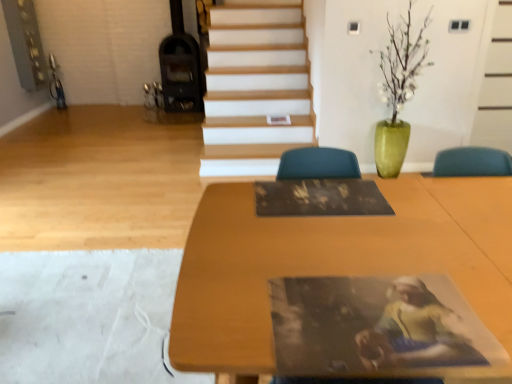
In order to click on dark brown wood fireplace at upper left in this screenshot , I will do `click(177, 77)`.

The image size is (512, 384). What do you see at coordinates (177, 77) in the screenshot?
I see `dark brown wood fireplace at upper left` at bounding box center [177, 77].

The image size is (512, 384). Describe the element at coordinates (334, 261) in the screenshot. I see `wooden table at center` at that location.

Find the location of a particular element. wooden table at center is located at coordinates (334, 261).

Based on the photo, what is the approximate width of wooden table at center?

The width of wooden table at center is 91.48 centimeters.

Looking at this image, what is the approximate height of wooden table at center?

78.17 centimeters.

Identify the location of dark brown wood fireplace at upper left. The image size is (512, 384). 177,77.

Which object is positioned more to the left, dark brown wood fireplace at upper left or wooden table at center?

Positioned to the left is dark brown wood fireplace at upper left.

In the image, is dark brown wood fireplace at upper left positioned in front of or behind wooden table at center?

Visually, dark brown wood fireplace at upper left is located behind wooden table at center.

Which is in front, point (163, 108) or point (485, 368)?

Point (485, 368)

From the image's perspective, does dark brown wood fireplace at upper left appear higher than wooden table at center?

Correct, dark brown wood fireplace at upper left appears higher than wooden table at center in the image.

From a real-world perspective, is dark brown wood fireplace at upper left beneath wooden table at center?

No, from a real-world perspective, dark brown wood fireplace at upper left is not under wooden table at center.

Between dark brown wood fireplace at upper left and wooden table at center, which one has larger width?

Wider between the two is wooden table at center.

Is dark brown wood fireplace at upper left taller than wooden table at center?

Yes.

Considering the relative sizes of dark brown wood fireplace at upper left and wooden table at center in the image provided, is dark brown wood fireplace at upper left smaller than wooden table at center?

Yes.

Is dark brown wood fireplace at upper left situated inside wooden table at center or outside?

dark brown wood fireplace at upper left lies outside wooden table at center.

Based on the photo, is the surface of dark brown wood fireplace at upper left in direct contact with wooden table at center?

No, dark brown wood fireplace at upper left is not beside wooden table at center.

Could you tell me if dark brown wood fireplace at upper left is turned towards wooden table at center?

No, dark brown wood fireplace at upper left is not turned towards wooden table at center.

At what (x,y) coordinates should I click in order to perform the action: click on fireplace lying above the wooden table at center (from the image's perspective). Please return your answer as a coordinate pair (x, y). This screenshot has height=384, width=512. Looking at the image, I should click on (177, 77).

Can you confirm if wooden table at center is positioned to the left of dark brown wood fireplace at upper left?

Incorrect, wooden table at center is not on the left side of dark brown wood fireplace at upper left.

In the scene shown: Is wooden table at center in front of or behind dark brown wood fireplace at upper left in the image?

Clearly, wooden table at center is in front of dark brown wood fireplace at upper left.

Does point (507, 177) come behind point (176, 71)?

No, (507, 177) is closer to viewer.

From the image's perspective, is wooden table at center above or below dark brown wood fireplace at upper left?

From the image's perspective, wooden table at center appears below dark brown wood fireplace at upper left.

Based on the photo, from a real-world perspective, is wooden table at center below dark brown wood fireplace at upper left?

Yes, from a real-world perspective, wooden table at center is under dark brown wood fireplace at upper left.

Which of these two, wooden table at center or dark brown wood fireplace at upper left, is thinner?

Thinner between the two is dark brown wood fireplace at upper left.

Based on the photo, is wooden table at center shorter than dark brown wood fireplace at upper left?

Indeed, wooden table at center has a lesser height compared to dark brown wood fireplace at upper left.

Looking at the image, does wooden table at center seem bigger or smaller compared to dark brown wood fireplace at upper left?

Clearly, wooden table at center is larger in size than dark brown wood fireplace at upper left.

Can we say wooden table at center lies outside dark brown wood fireplace at upper left?

wooden table at center lies outside dark brown wood fireplace at upper left's area.

From the picture: Would you say wooden table at center is a long distance from dark brown wood fireplace at upper left?

Indeed, wooden table at center is not near dark brown wood fireplace at upper left.

Could you tell me if wooden table at center is turned towards dark brown wood fireplace at upper left?

No, wooden table at center is not turned towards dark brown wood fireplace at upper left.

Measure the distance between wooden table at center and dark brown wood fireplace at upper left.

wooden table at center and dark brown wood fireplace at upper left are 13.28 feet apart.

Identify the location of table below the dark brown wood fireplace at upper left (from a real-world perspective). The image size is (512, 384). (334, 261).

At what (x,y) coordinates should I click in order to perform the action: click on fireplace above the wooden table at center (from the image's perspective). Please return your answer as a coordinate pair (x, y). Looking at the image, I should click on (177, 77).

The width and height of the screenshot is (512, 384). In the image, there is a dark brown wood fireplace at upper left. Find the location of `table below it (from the image's perspective)`. table below it (from the image's perspective) is located at coordinates pos(334,261).